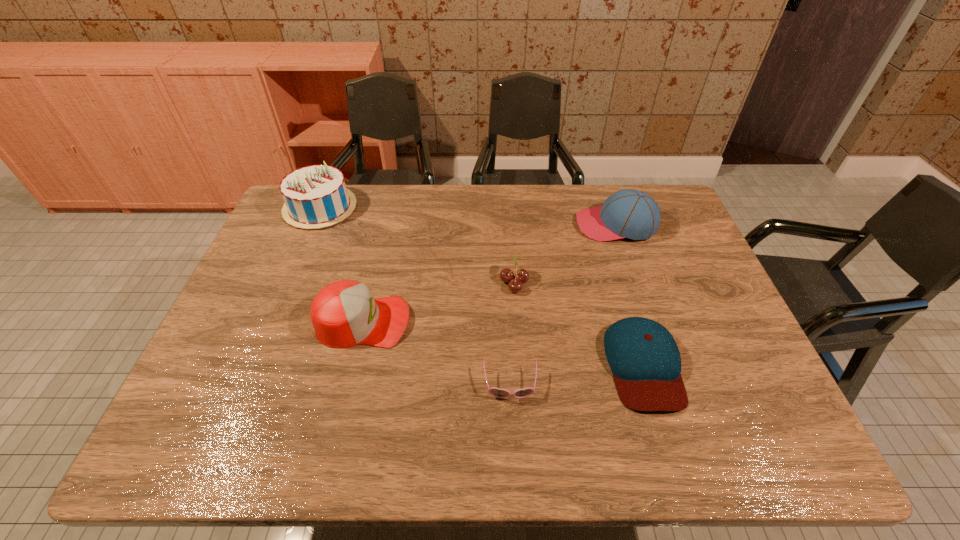
Identify the location of blank space located 0.180m on the front-facing side of the leftmost baseball cap. The height and width of the screenshot is (540, 960). (478, 321).

At what (x,y) coordinates should I click in order to perform the action: click on vacant space located on the leaves of the third farthest object. Please return your answer as a coordinate pair (x, y). The height and width of the screenshot is (540, 960). Looking at the image, I should click on (450, 282).

You are a GUI agent. You are given a task and a screenshot of the screen. Output one action in this format:
    pyautogui.click(x=<x>, y=<y>)
    Task: Click on the vacant space located on the leaves of the third farthest object
    The width and height of the screenshot is (960, 540).
    Given the screenshot: What is the action you would take?
    pyautogui.click(x=457, y=282)

I want to click on free point located 0.380m on the leaves of the third farthest object, so click(x=366, y=282).

This screenshot has height=540, width=960. In order to click on free space located 0.090m with the bill of the shortest baseball cap facing forward in this screenshot , I will do `click(671, 455)`.

Where is `vacant space located on the front-facing side of the shortest object`? This screenshot has height=540, width=960. vacant space located on the front-facing side of the shortest object is located at coordinates (513, 431).

The image size is (960, 540). I want to click on birthday cake situated at the far edge, so click(x=315, y=196).

Image resolution: width=960 pixels, height=540 pixels. Find the location of `baseball cap positioned at the far edge`. baseball cap positioned at the far edge is located at coordinates (629, 213).

Locate an element on the screen. object that is at the left edge is located at coordinates (315, 196).

Where is `object that is at the right edge`? This screenshot has height=540, width=960. object that is at the right edge is located at coordinates (629, 213).